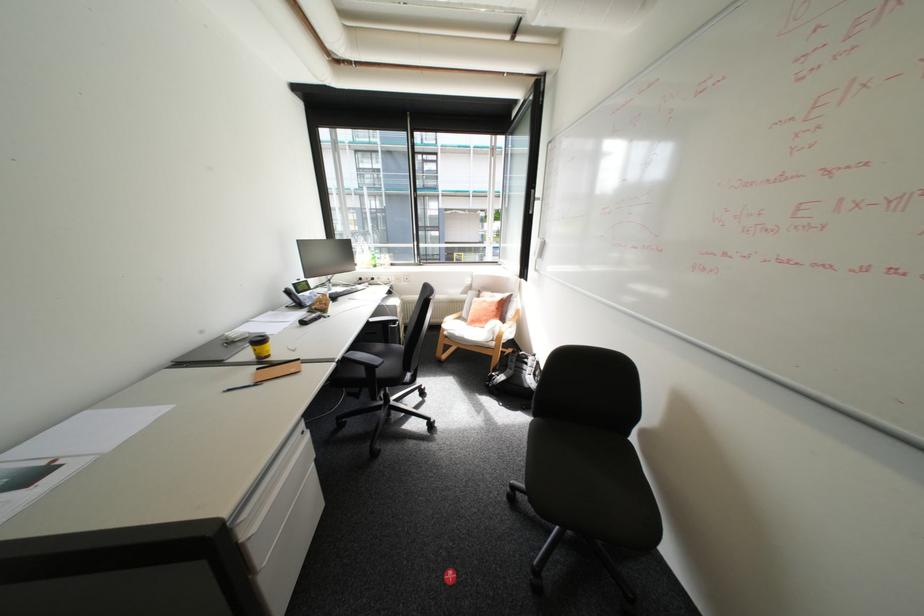
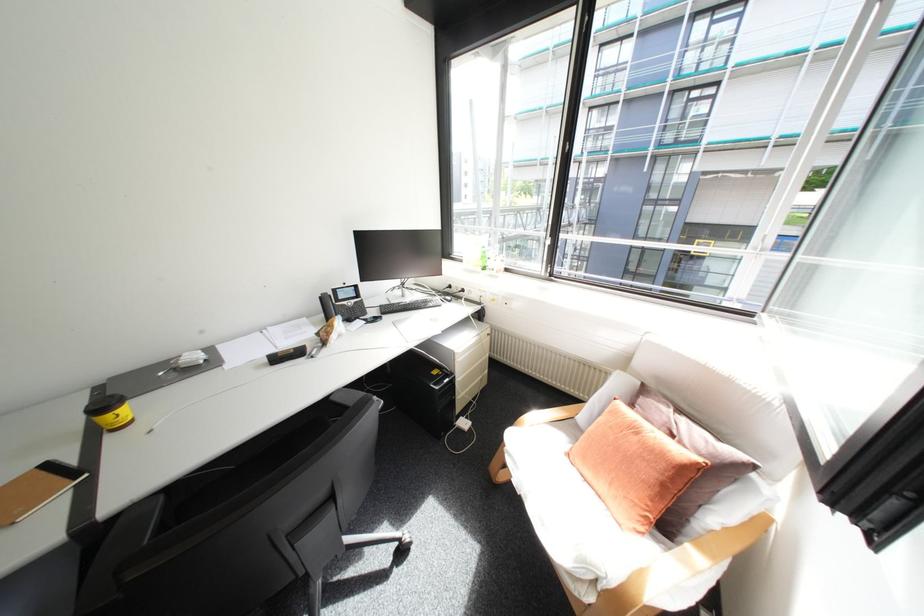
Find the pixel in the second image that matches point 487,306 in the first image.

(621, 428)